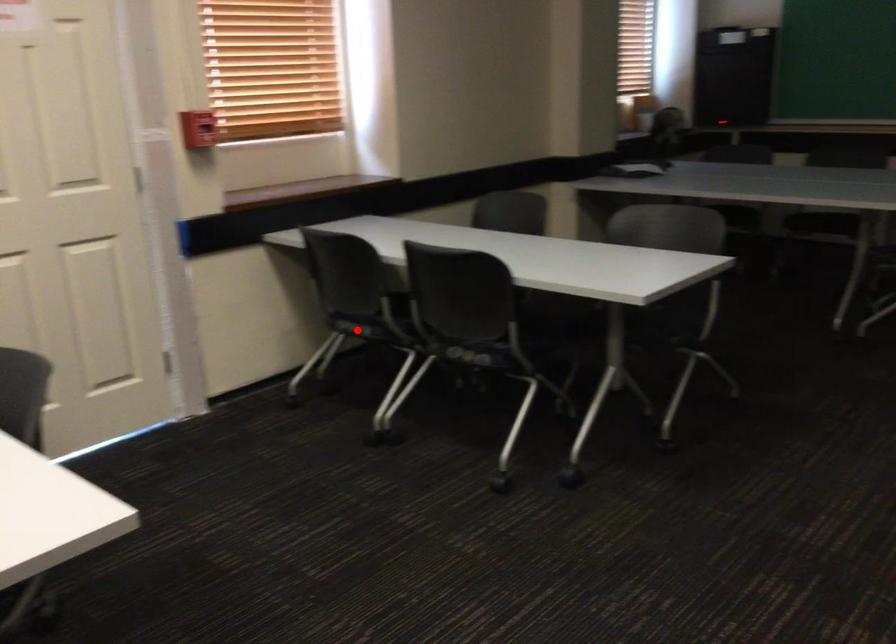
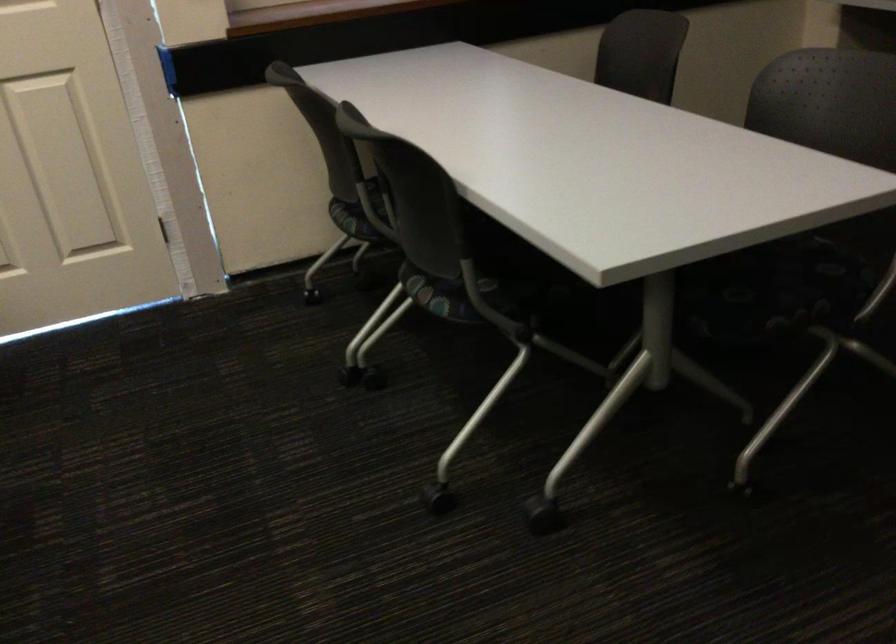
Question: I am providing you with two images of the same scene from different viewpoints. A red point is marked on the first image. At the location where the point appears in image 1, is it still visible in image 2?

Choices:
 (A) Yes
 (B) No

Answer: (A)